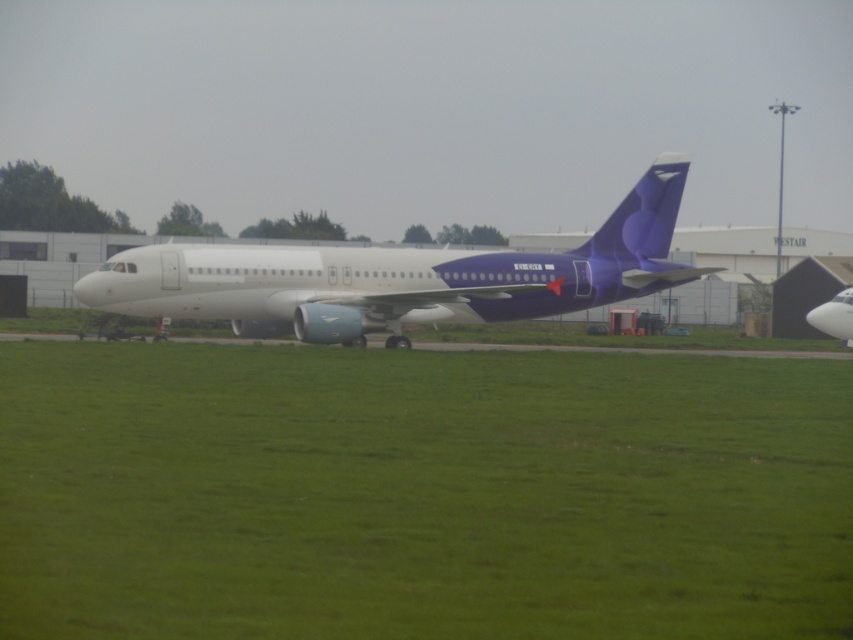
Question: Among these points, which one is farthest from the camera?

Choices:
 (A) (351, 280)
 (B) (828, 321)
 (C) (490, 499)

Answer: (B)

Question: Does green grass at center appear under white matte airplane at center?

Choices:
 (A) yes
 (B) no

Answer: (A)

Question: Does white glossy airplane at center appear over white matte airplane at center?

Choices:
 (A) yes
 (B) no

Answer: (A)

Question: Based on their relative distances, which object is nearer to the green grass at center?

Choices:
 (A) white glossy airplane at center
 (B) white matte airplane at center

Answer: (A)

Question: Based on their relative distances, which object is nearer to the white matte airplane at center?

Choices:
 (A) green grass at center
 (B) white glossy airplane at center

Answer: (B)

Question: Is white glossy airplane at center further to camera compared to white matte airplane at center?

Choices:
 (A) yes
 (B) no

Answer: (B)